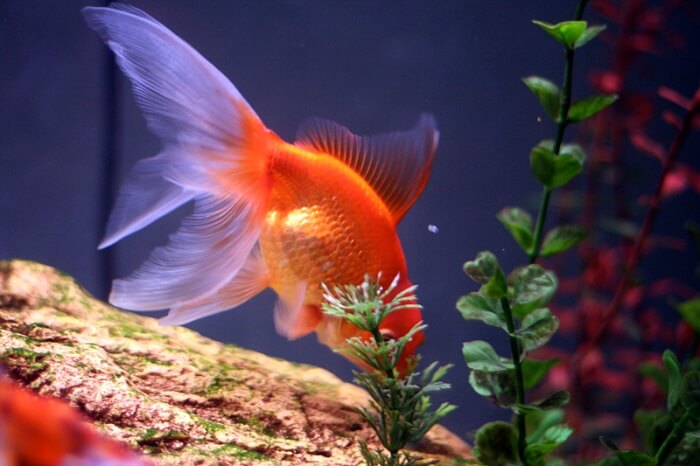
Locate an element on the screen. greens plants is located at coordinates (393, 399), (516, 330), (554, 164), (679, 420).